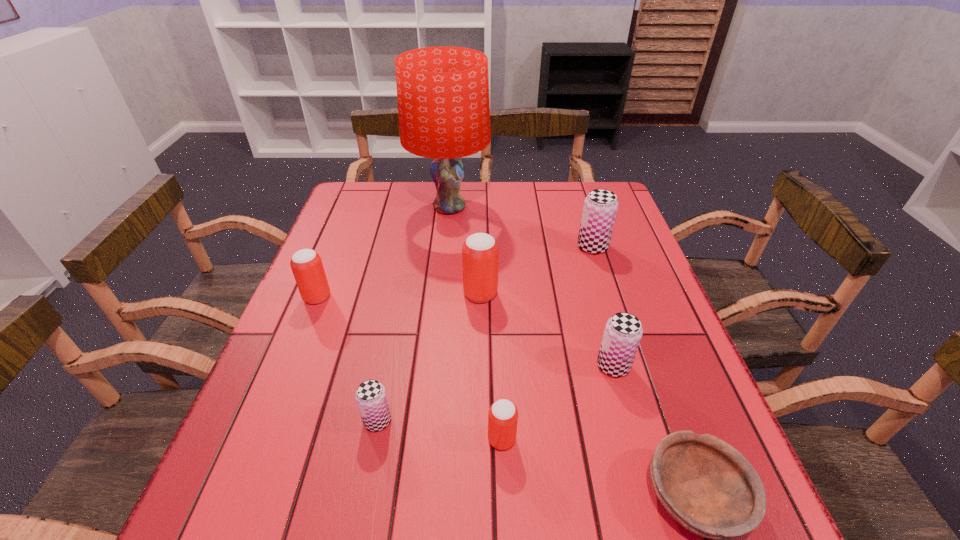
This screenshot has height=540, width=960. What are the coordinates of `the tallest object` in the screenshot? It's located at (443, 92).

This screenshot has width=960, height=540. In order to click on lampshade in this screenshot , I will do `click(443, 92)`.

Find the location of a particular element. The height and width of the screenshot is (540, 960). the biggest purple beer can is located at coordinates (600, 207).

I want to click on the farthest purple beer can, so click(x=600, y=207).

This screenshot has width=960, height=540. I want to click on the biggest red beer can, so click(x=480, y=252).

Locate an element on the screen. The image size is (960, 540). the third nearest beer can is located at coordinates (623, 332).

The height and width of the screenshot is (540, 960). In order to click on the fifth farthest object in this screenshot , I will do `click(623, 332)`.

Locate an element on the screen. the leftmost object is located at coordinates (306, 264).

Locate an element on the screen. the leftmost red beer can is located at coordinates (306, 264).

Where is `the second beer can from left to right`? The height and width of the screenshot is (540, 960). the second beer can from left to right is located at coordinates (371, 398).